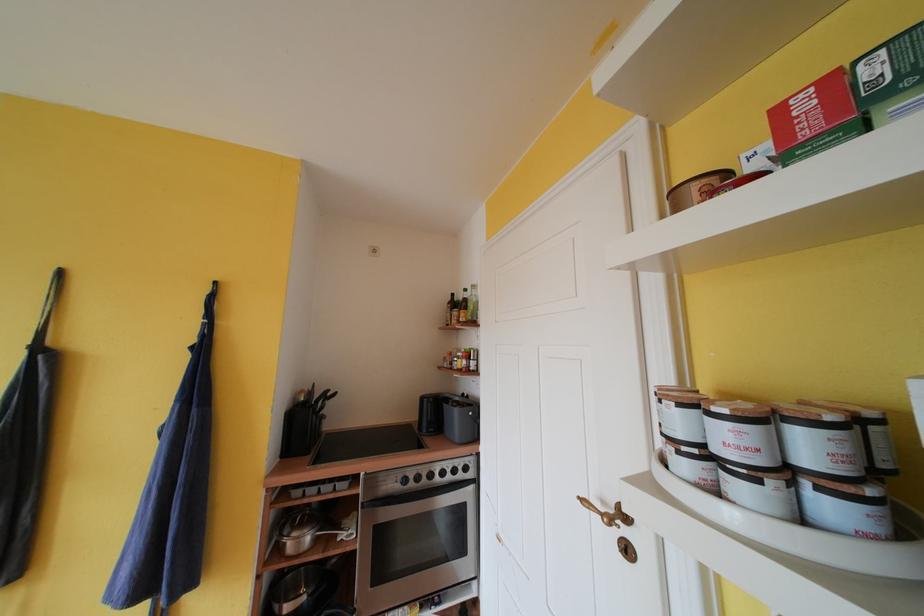
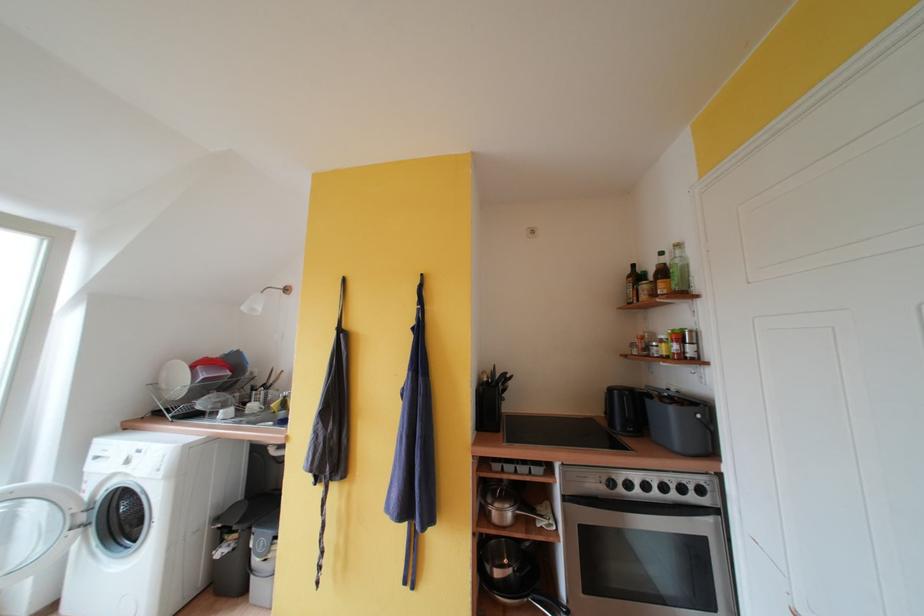
Where in the second image is the point corresponding to point (67, 277) from the first image?

(350, 284)